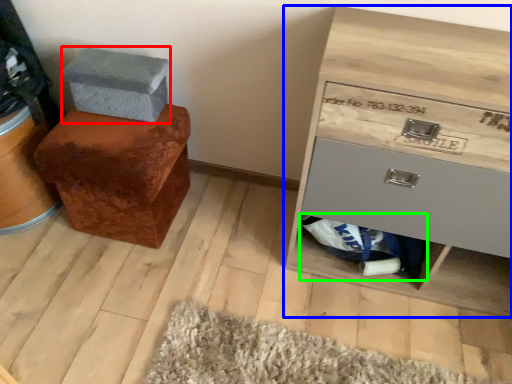
Question: Which object is positioned closest to shoe box (highlighted by a red box)? Select from chest of drawers (highlighted by a blue box) and material (highlighted by a green box).

Choices:
 (A) chest of drawers
 (B) material

Answer: (A)